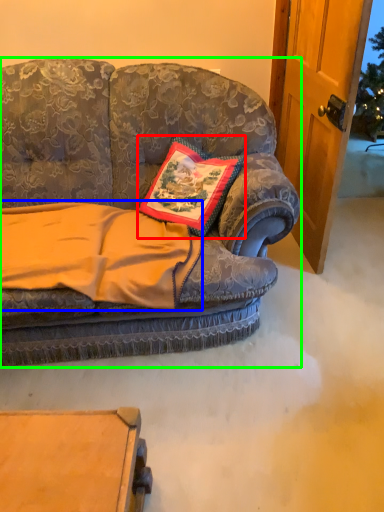
Question: Estimate the real-world distances between objects in this image. Which object is farther from pillow (highlighted by a red box), blanket (highlighted by a blue box) or studio couch (highlighted by a green box)?

Choices:
 (A) blanket
 (B) studio couch

Answer: (A)